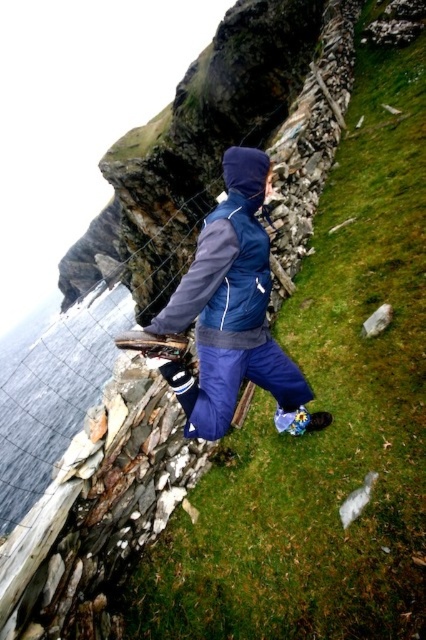
Question: Can you confirm if blue fabric jacket at center is smaller than blue fleece jacket at center?

Choices:
 (A) no
 (B) yes

Answer: (A)

Question: Observing the image, what is the correct spatial positioning of blue fabric jacket at center in reference to transparent water at lower left?

Choices:
 (A) right
 (B) left

Answer: (A)

Question: From the image, what is the correct spatial relationship of blue fabric jacket at center in relation to transparent water at lower left?

Choices:
 (A) below
 (B) above

Answer: (B)

Question: Which point is closer to the camera?

Choices:
 (A) transparent water at lower left
 (B) blue fabric jacket at center

Answer: (B)

Question: Which point is farther to the camera?

Choices:
 (A) transparent water at lower left
 (B) blue fleece jacket at center

Answer: (A)

Question: Which is nearer to the blue fleece jacket at center?

Choices:
 (A) transparent water at lower left
 (B) blue fabric jacket at center

Answer: (B)